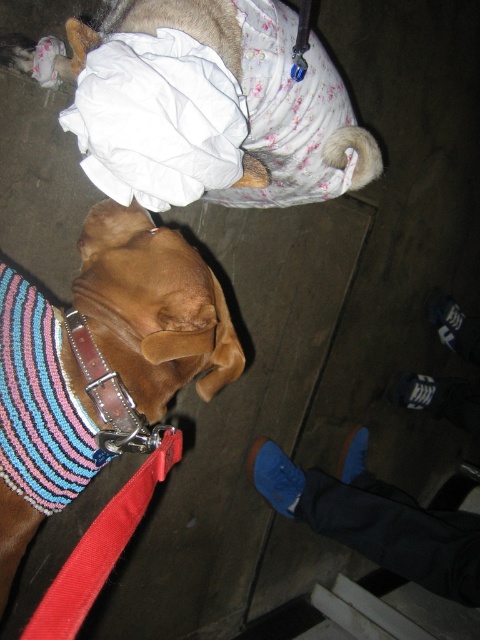
You are a pet photographer aiming to capture a photo of the fluffy white fur at upper center and the red fabric leash at lower left. Which object should you focus on first to ensure it appears sharp in the photo?

The fluffy white fur at upper center is closer to the viewer than the red fabric leash at lower left, so you should focus on the fluffy white fur at upper center first to ensure it appears sharp in the photo.

You are standing in the room where the two dogs are. You want to place a small toy between the two points, point (157, 205) and point (160, 442). Which point should you place the toy closer to so that it is in front of the second dog?

You should place the toy closer to point (157, 205) because it is in front of point (160, 442), meaning the toy will be in front of the second dog.